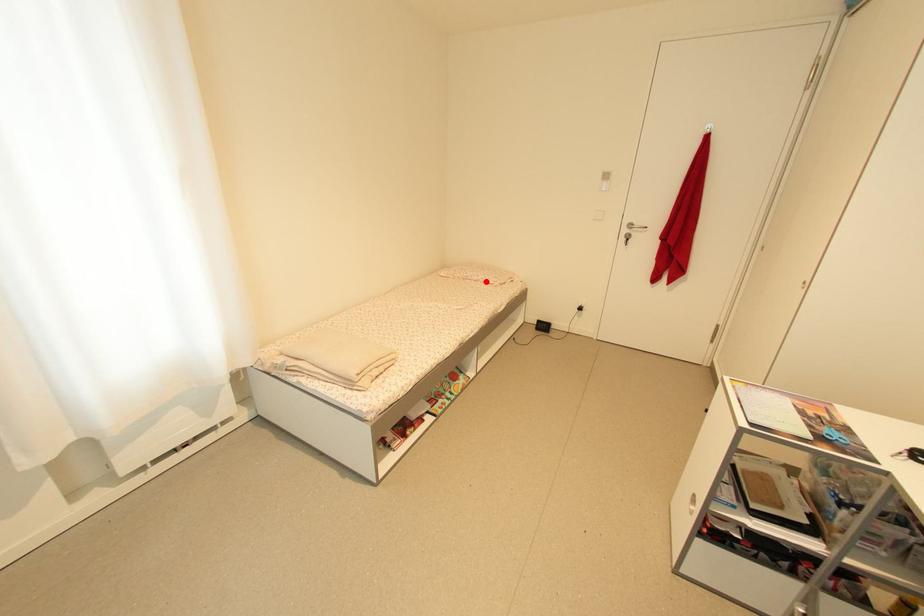
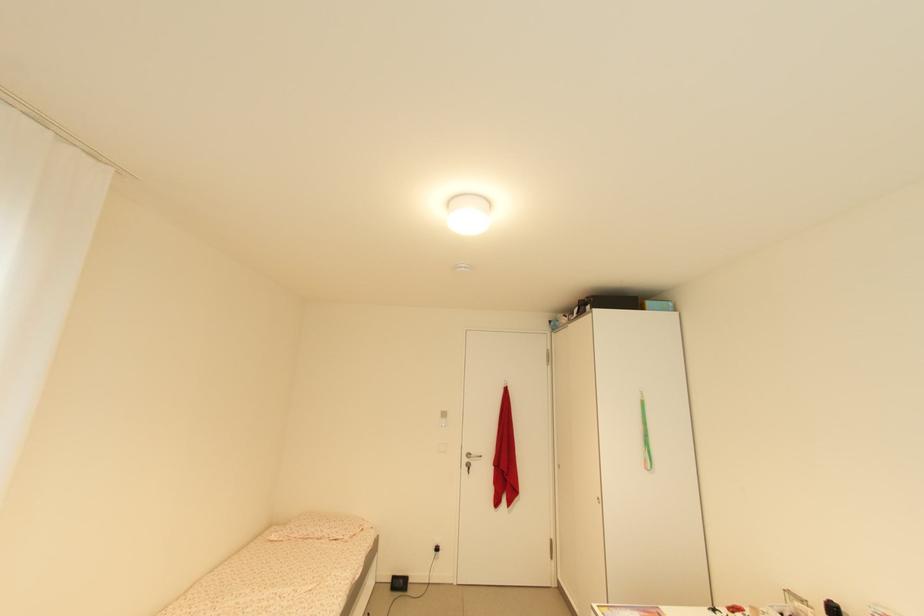
Locate, in the second image, the point that corresponds to the highlighted location in the first image.

(332, 538)